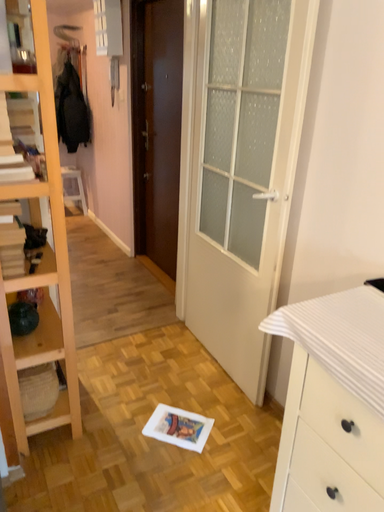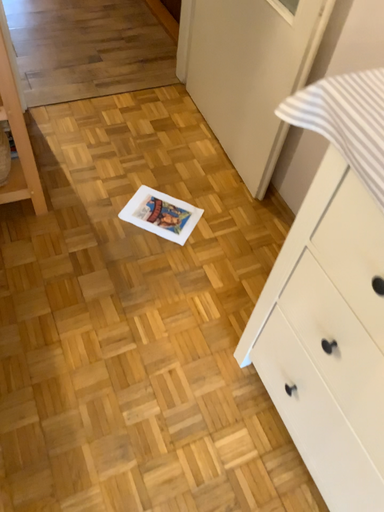
Question: Which way did the camera rotate in the video?

Choices:
 (A) rotated upward
 (B) rotated downward

Answer: (B)